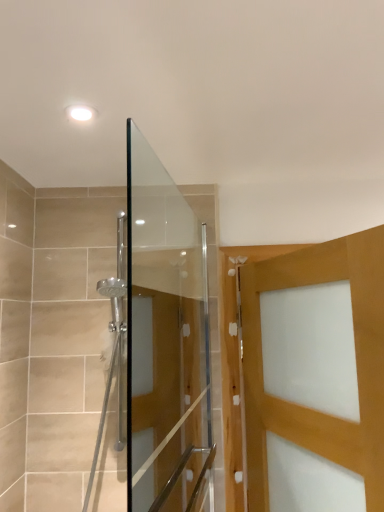
Question: Is point (153, 194) closer or farther from the camera than point (322, 415)?

Choices:
 (A) closer
 (B) farther

Answer: (B)

Question: Is transparent glass shower door at center spatially inside matte wooden door at right, or outside of it?

Choices:
 (A) inside
 (B) outside

Answer: (B)

Question: In terms of height, does transparent glass shower door at center look taller or shorter compared to matte wooden door at right?

Choices:
 (A) tall
 (B) short

Answer: (A)

Question: From the image's perspective, relative to transparent glass shower door at center, is matte wooden door at right above or below?

Choices:
 (A) below
 (B) above

Answer: (A)

Question: Is matte wooden door at right bigger or smaller than transparent glass shower door at center?

Choices:
 (A) big
 (B) small

Answer: (A)

Question: Is matte wooden door at right situated inside transparent glass shower door at center or outside?

Choices:
 (A) inside
 (B) outside

Answer: (B)

Question: Visually, is matte wooden door at right positioned to the left or to the right of transparent glass shower door at center?

Choices:
 (A) left
 (B) right

Answer: (B)